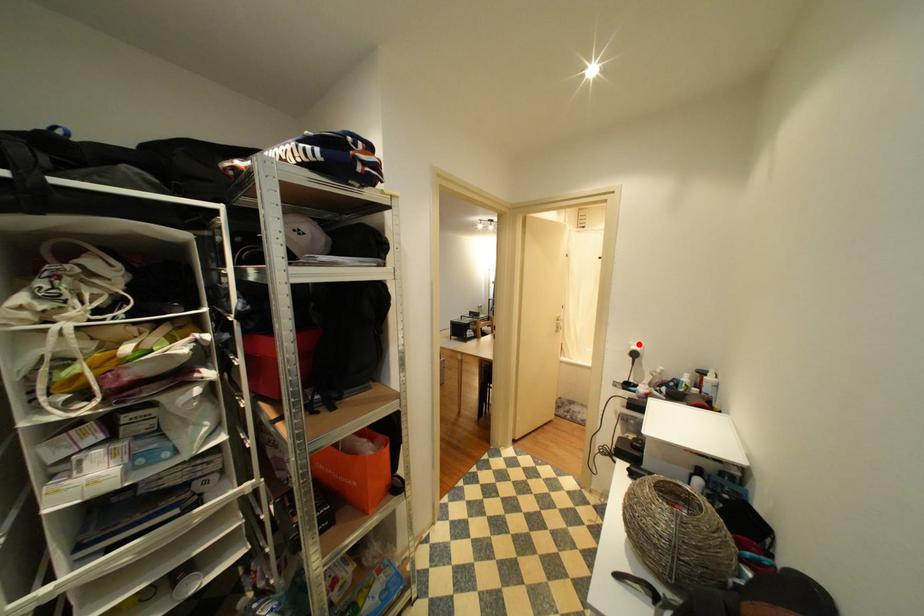
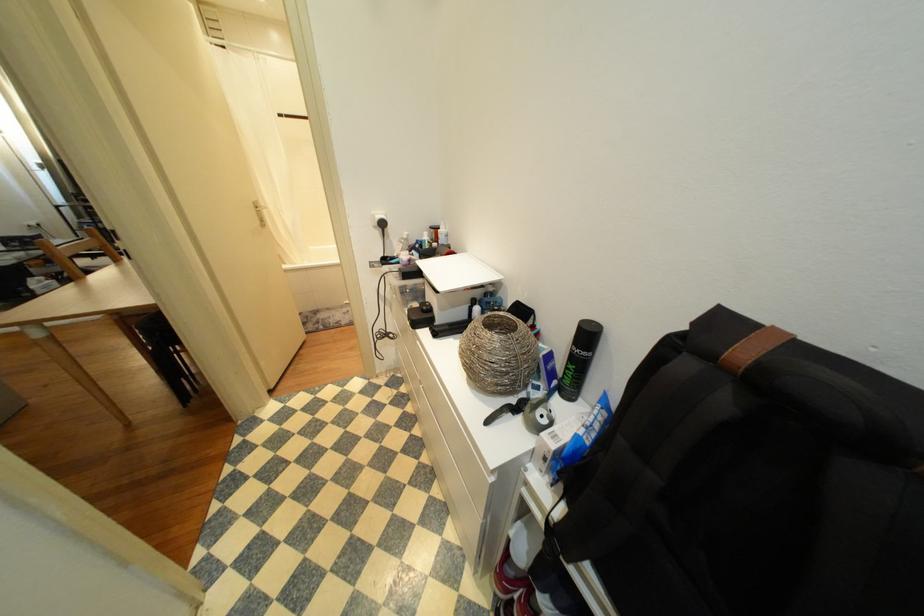
In the second image, find the point that corresponds to the highlighted location in the first image.

(381, 214)